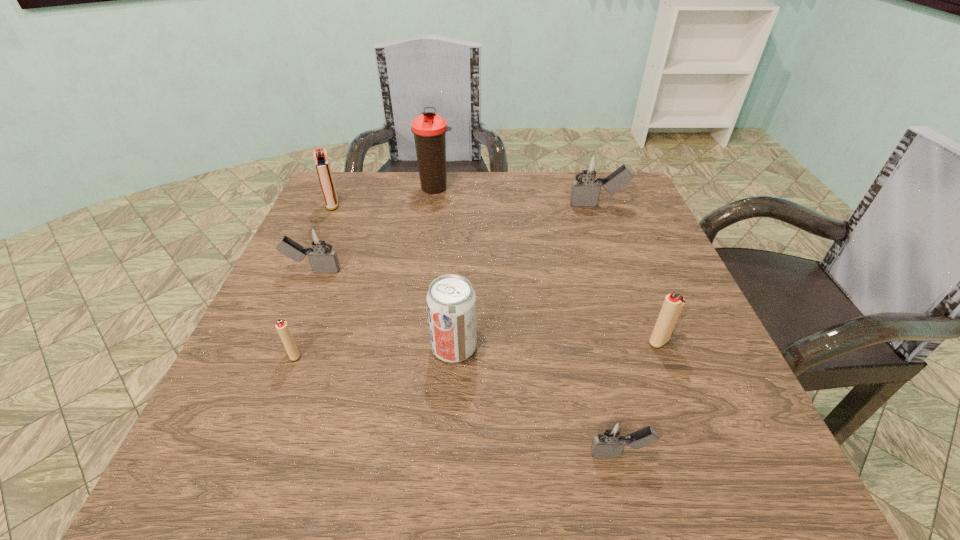
The width and height of the screenshot is (960, 540). Find the location of `the nearest igniter`. the nearest igniter is located at coordinates (612, 435).

This screenshot has height=540, width=960. Find the location of `the nearest gray igniter`. the nearest gray igniter is located at coordinates (612, 435).

Identify the location of vacant space located 0.100m on the left of the brown thermos bottle. The height and width of the screenshot is (540, 960). (381, 187).

Image resolution: width=960 pixels, height=540 pixels. In order to click on free space located 0.130m on the right of the farthest red igniter in this screenshot , I will do `click(390, 205)`.

The image size is (960, 540). Identify the location of free spot located 0.330m on the front of the farthest gray igniter. [x=635, y=307].

Where is `free space located 0.110m on the back of the soda can`? The image size is (960, 540). free space located 0.110m on the back of the soda can is located at coordinates (457, 289).

Find the location of a particular element. free space located 0.100m on the back of the second farthest gray igniter is located at coordinates (328, 234).

The width and height of the screenshot is (960, 540). I want to click on free spot located 0.260m on the back of the second smallest red igniter, so click(623, 247).

What are the coordinates of `vacant region located on the back of the second red igniter from right to left` in the screenshot? It's located at (345, 225).

Identify the location of vacant space located 0.370m on the left of the smallest gray igniter. This screenshot has height=540, width=960. (339, 454).